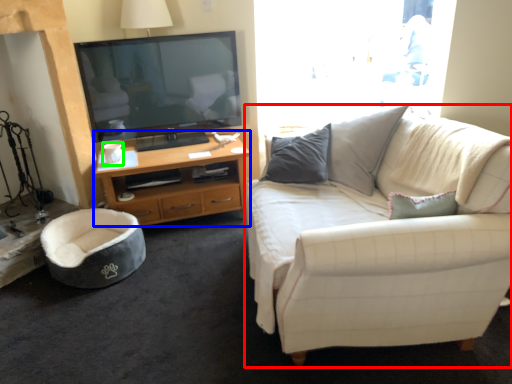
Question: Which object is positioned farthest from studio couch (highlighted by a red box)? Select from desk (highlighted by a blue box) and coffee cup (highlighted by a green box).

Choices:
 (A) desk
 (B) coffee cup

Answer: (B)